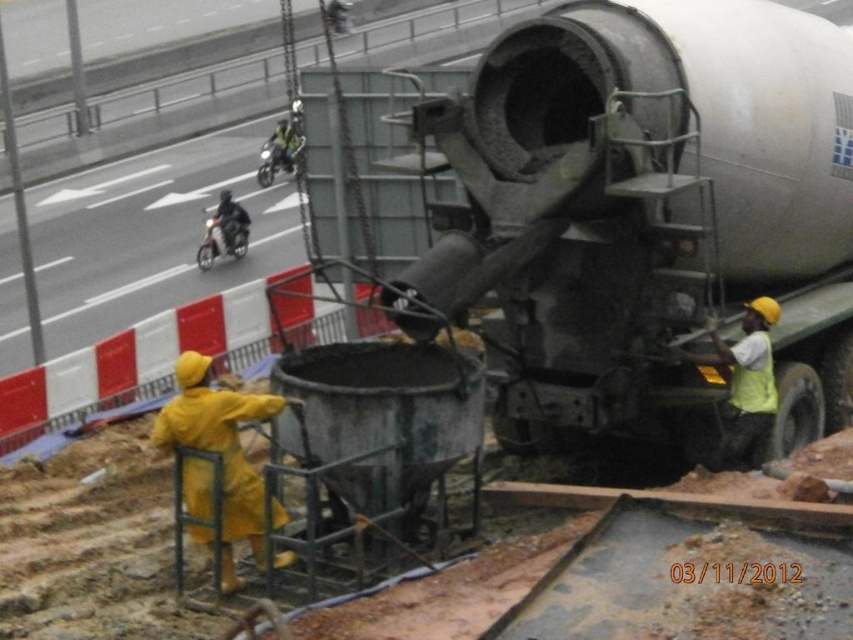
Question: Can you confirm if matte gray tank at right is smaller than yellow rubber raincoat at lower left?

Choices:
 (A) yes
 (B) no

Answer: (B)

Question: Which point is farther to the camera?

Choices:
 (A) shiny black motorcycle at upper left
 (B) green matte motorcycle at upper center
 (C) matte gray tank at right
 (D) yellow rubber raincoat at lower left

Answer: (B)

Question: Which object appears farthest from the camera in this image?

Choices:
 (A) shiny black motorcycle at upper left
 (B) yellow rubber raincoat at lower left
 (C) matte gray tank at right
 (D) green matte motorcycle at upper center

Answer: (D)

Question: Which object appears farthest from the camera in this image?

Choices:
 (A) yellow rubber raincoat at lower left
 (B) matte gray tank at right
 (C) shiny black motorcycle at upper left

Answer: (C)

Question: Observing the image, what is the correct spatial positioning of matte gray tank at right in reference to green matte motorcycle at upper center?

Choices:
 (A) below
 (B) above

Answer: (A)

Question: Does shiny black motorcycle at upper left lie in front of green matte motorcycle at upper center?

Choices:
 (A) no
 (B) yes

Answer: (B)